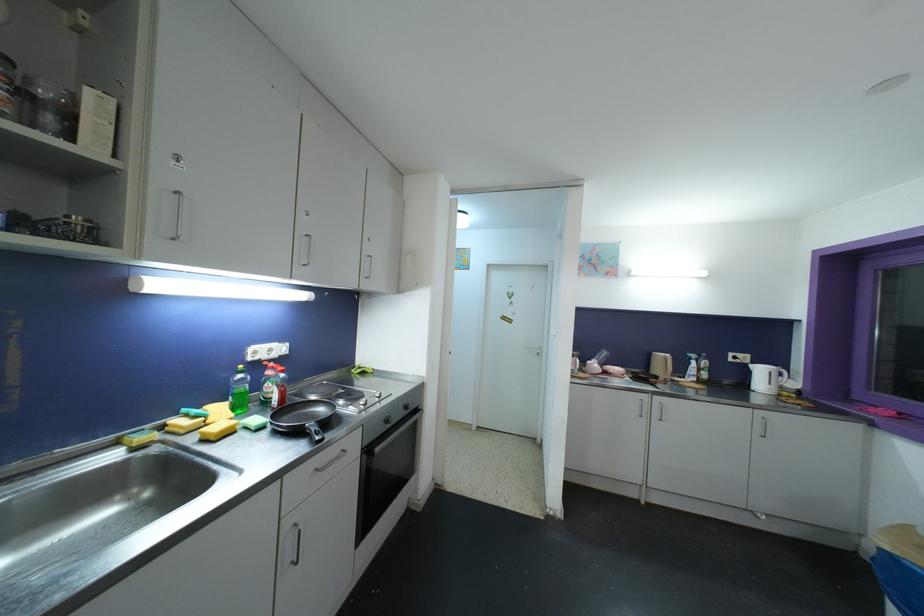
At what (x,y) coordinates should I click in order to perform the action: click on beige appliance handle. Please return your answer as a coordinate pair (x, y). This screenshot has width=924, height=616. Looking at the image, I should click on (667, 367).